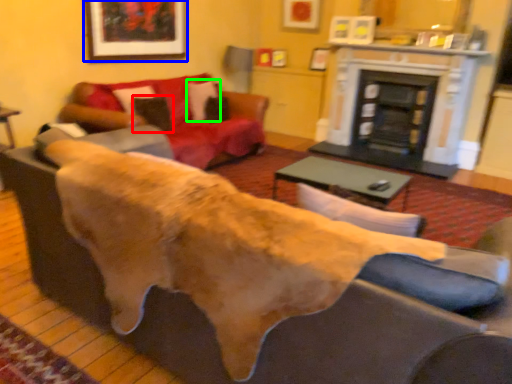
Question: Which is farther away from pillow (highlighted by a red box)? picture frame (highlighted by a blue box) or pillow (highlighted by a green box)?

Choices:
 (A) picture frame
 (B) pillow

Answer: (A)